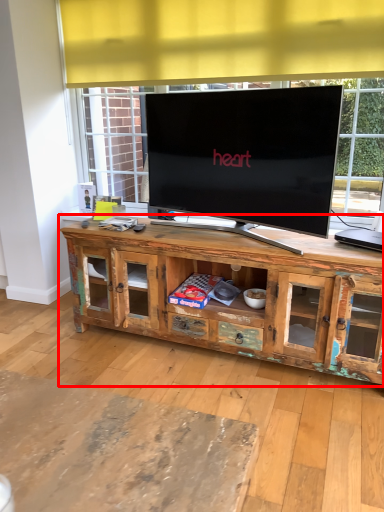
Question: From the image's perspective, where is cabinetry (annotated by the red box) located in relation to computer in the image?

Choices:
 (A) below
 (B) above

Answer: (A)